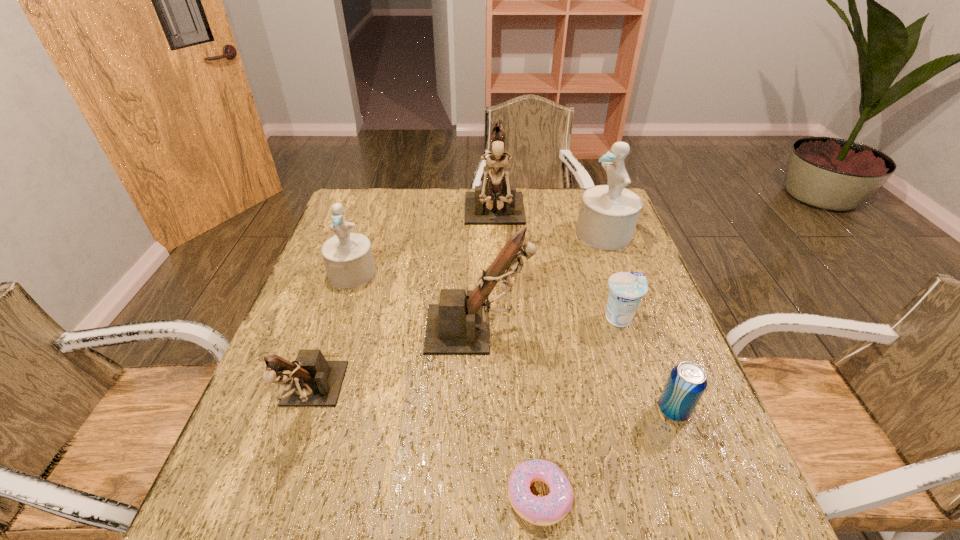
Identify the location of vacant area at the left edge. (354, 294).

Locate an element on the screen. The height and width of the screenshot is (540, 960). vacant space at the right edge of the desktop is located at coordinates (650, 449).

Where is `empty space that is in between the blue beer can and the second nearest brown figurine`? The image size is (960, 540). empty space that is in between the blue beer can and the second nearest brown figurine is located at coordinates (576, 369).

The image size is (960, 540). Find the location of `free area in between the farthest brown figurine and the smaller white figurine`. free area in between the farthest brown figurine and the smaller white figurine is located at coordinates (423, 246).

The image size is (960, 540). What are the coordinates of `unoccupied area between the right white figurine and the smaller white figurine` in the screenshot? It's located at (478, 253).

Identify the location of vacant point located between the shortest object and the leftmost brown figurine. Image resolution: width=960 pixels, height=540 pixels. (425, 447).

This screenshot has width=960, height=540. Identify the location of free space between the beer can and the blue yogurt. (646, 364).

I want to click on vacant area that lies between the nearest brown figurine and the second biggest brown figurine, so click(394, 363).

Find the location of `vacant area that lies between the smaller white figurine and the second smallest brown figurine`. vacant area that lies between the smaller white figurine and the second smallest brown figurine is located at coordinates (415, 301).

You are a GUI agent. You are given a task and a screenshot of the screen. Output one action in this format:
    pyautogui.click(x=<x>, y=<y>)
    Task: Click on the vacant space in between the third farthest object and the rightmost figurine
    The image size is (960, 540).
    Given the screenshot: What is the action you would take?
    pyautogui.click(x=478, y=253)